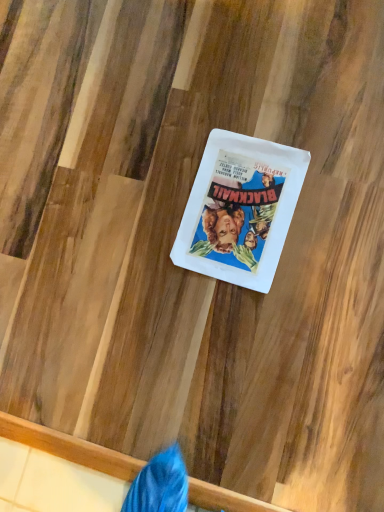
I want to click on vacant area that lies in front of white paper at center, so click(306, 300).